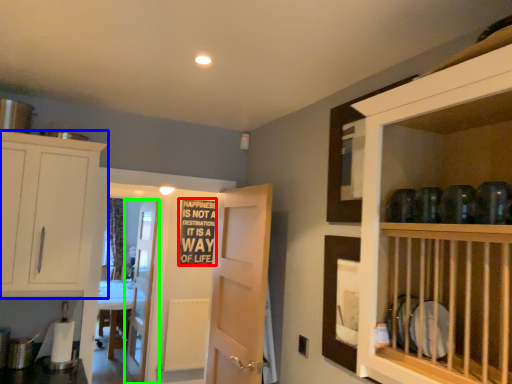
Question: Which is farther away from writing (highlighted by a red box)? cabinetry (highlighted by a blue box) or door (highlighted by a green box)?

Choices:
 (A) cabinetry
 (B) door

Answer: (A)